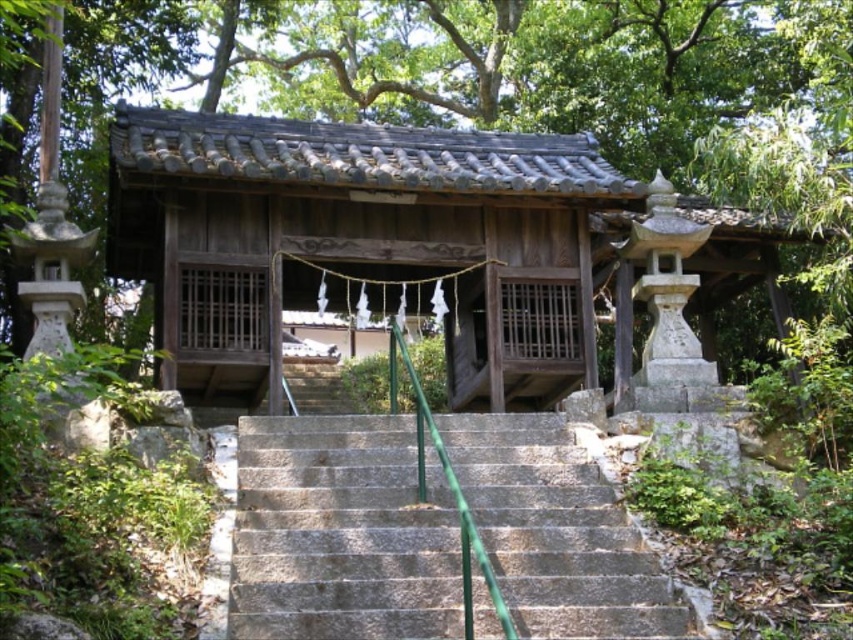
You are standing at the entrance of the shrine and want to go down the gray stone stairs at center. Which direction should you face to descend them?

The gray stone stairs at center are located at point (341, 532), so you should face the direction of that coordinate to descend them.

You are standing at the entrance of the shrine and notice a point marked at coordinates (341, 532). Based on the scene description, what object is located at this point?

The point at coordinates (341, 532) indicates the location of the gray stone stairs at center.